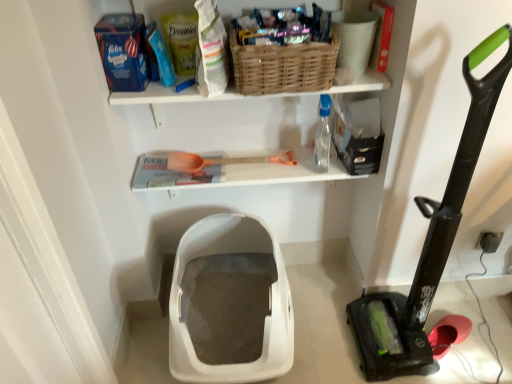
You are a GUI agent. You are given a task and a screenshot of the screen. Output one action in this format:
    pyautogui.click(x=<x>, y=<y>)
    Task: Click on the vacant area situated to the left side of black rubber vacuum at right
    The height and width of the screenshot is (384, 512).
    Given the screenshot: What is the action you would take?
    pyautogui.click(x=328, y=334)